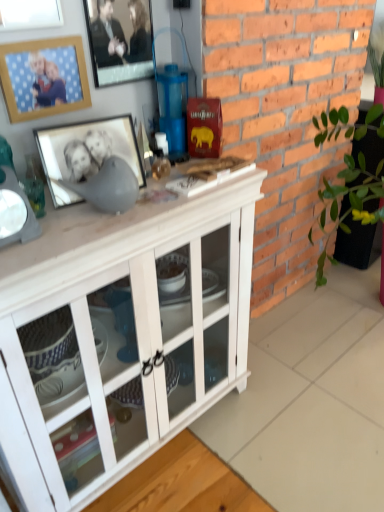
Question: Visually, is metallic silver picture frame at upper center, acting as the 1th picture frame starting from the top, positioned to the left or to the right of brick at right?

Choices:
 (A) right
 (B) left

Answer: (B)

Question: Considering the positions of point (137, 14) and point (243, 10), is point (137, 14) closer or farther from the camera than point (243, 10)?

Choices:
 (A) closer
 (B) farther

Answer: (A)

Question: Which is nearer to the brick at right?

Choices:
 (A) metallic silver picture frame at upper center, arranged as the third picture frame when ordered from the bottom
 (B) white wood cabinet at center
 (C) matte black picture frame at upper left, which is the 3th picture frame from top to bottom
 (D) wooden picture frame at upper left, the second picture frame from the bottom

Answer: (B)

Question: Which is farther from the brick at right?

Choices:
 (A) white wood cabinet at center
 (B) matte black picture frame at upper left, which is the 3th picture frame from top to bottom
 (C) metallic silver picture frame at upper center, arranged as the third picture frame when ordered from the bottom
 (D) wooden picture frame at upper left, the second picture frame from the bottom

Answer: (D)